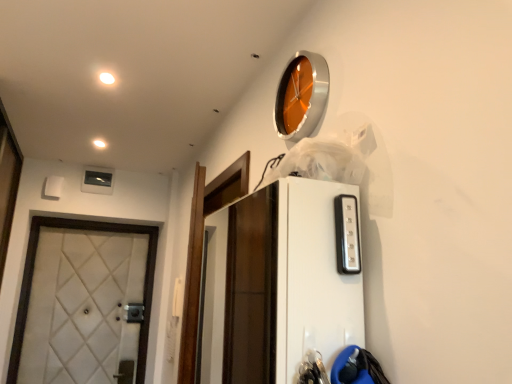
Question: Is point (42, 220) positioned closer to the camera than point (112, 82)?

Choices:
 (A) farther
 (B) closer

Answer: (A)

Question: Looking at the image, does white quilted fabric door at left seem bigger or smaller compared to white glossy light at upper left, the 2th light when ordered from left to right?

Choices:
 (A) small
 (B) big

Answer: (B)

Question: Considering the real-world distances, which object is farthest from the white glossy light at upper left, placed as the 2th light when sorted from back to front?

Choices:
 (A) white quilted fabric door at left
 (B) matte white light at upper left, which is counted as the second light, starting from the right
 (C) orange metallic clock at upper center

Answer: (A)

Question: Estimate the real-world distances between objects in this image. Which object is closer to the matte white light at upper left, which is counted as the second light, starting from the top?

Choices:
 (A) orange metallic clock at upper center
 (B) white quilted fabric door at left
 (C) white glossy light at upper left, placed as the 2th light when sorted from back to front

Answer: (C)